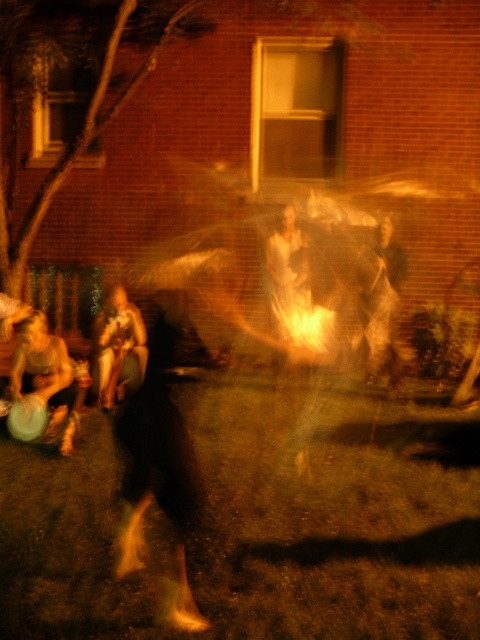
Question: Is matte black frisbee at lower left closer to the viewer compared to dark fabric bag at center?

Choices:
 (A) no
 (B) yes

Answer: (B)

Question: Does dark fabric bag at center appear under smooth beige sweater at lower left?

Choices:
 (A) no
 (B) yes

Answer: (A)

Question: Estimate the real-world distances between objects in this image. Which object is farther from the smooth beige sweater at lower left?

Choices:
 (A) matte black frisbee at lower left
 (B) dark fabric bag at center

Answer: (B)

Question: Which of the following is the farthest from the observer?

Choices:
 (A) dark fabric bag at center
 (B) smooth beige sweater at lower left

Answer: (A)

Question: Which object is the farthest from the dark fabric bag at center?

Choices:
 (A) matte black frisbee at lower left
 (B) smooth beige sweater at lower left

Answer: (A)

Question: Can you confirm if dark fabric bag at center is positioned below smooth beige sweater at lower left?

Choices:
 (A) yes
 (B) no

Answer: (B)